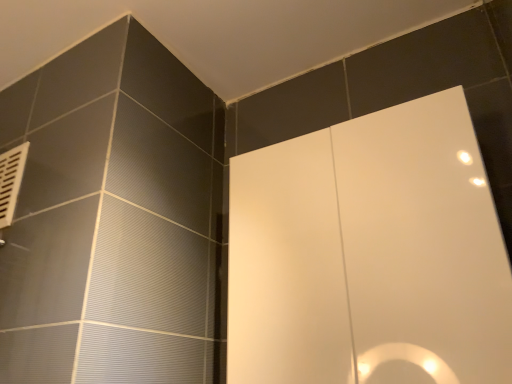
Question: From a real-world perspective, relative to white plastic vent at upper left, is white glossy screen door at center vertically above or below?

Choices:
 (A) below
 (B) above

Answer: (A)

Question: Is point (335, 347) closer or farther from the camera than point (2, 200)?

Choices:
 (A) farther
 (B) closer

Answer: (B)

Question: In terms of height, does white glossy screen door at center look taller or shorter compared to white plastic vent at upper left?

Choices:
 (A) tall
 (B) short

Answer: (A)

Question: From the image's perspective, is white plastic vent at upper left positioned above or below white glossy screen door at center?

Choices:
 (A) below
 (B) above

Answer: (B)

Question: Based on their sizes in the image, would you say white plastic vent at upper left is bigger or smaller than white glossy screen door at center?

Choices:
 (A) big
 (B) small

Answer: (B)

Question: Considering the positions of white plastic vent at upper left and white glossy screen door at center in the image, is white plastic vent at upper left taller or shorter than white glossy screen door at center?

Choices:
 (A) tall
 (B) short

Answer: (B)

Question: Would you say white plastic vent at upper left is to the left or to the right of white glossy screen door at center in the picture?

Choices:
 (A) left
 (B) right

Answer: (A)